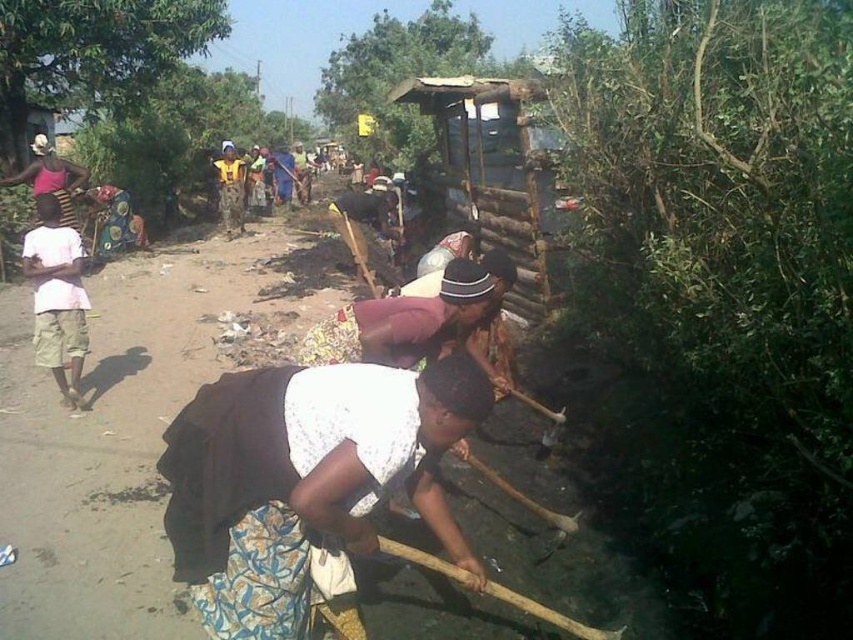
From the picture: You are a hiker trying to navigate between two green leafy trees in a rural area. The trees are labeled as green leafy tree at right and green leafy tree at upper left. Which tree would you need to look up higher to see the top of?

The green leafy tree at upper left is taller than the green leafy tree at right, so you would need to look up higher to see its top.

You are a photographer standing in the middle of the scene. You want to take a photo that includes both the green leafy tree at right and the white cotton shirt at left. Which object should you adjust your camera focus on first to ensure both are in the frame?

The green leafy tree at right is closer to the viewer than the white cotton shirt at left, so you should focus on the green leafy tree at right first to ensure both are in the frame.